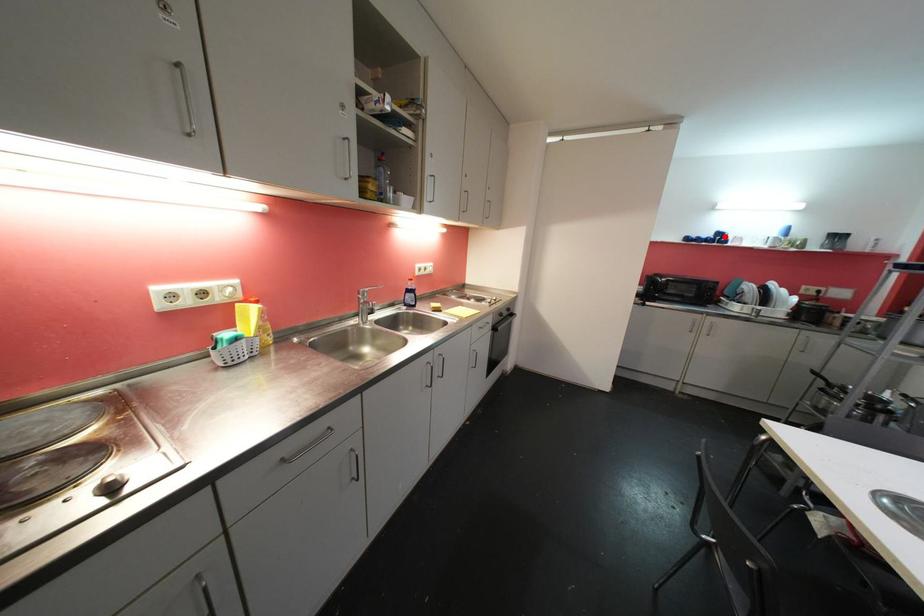
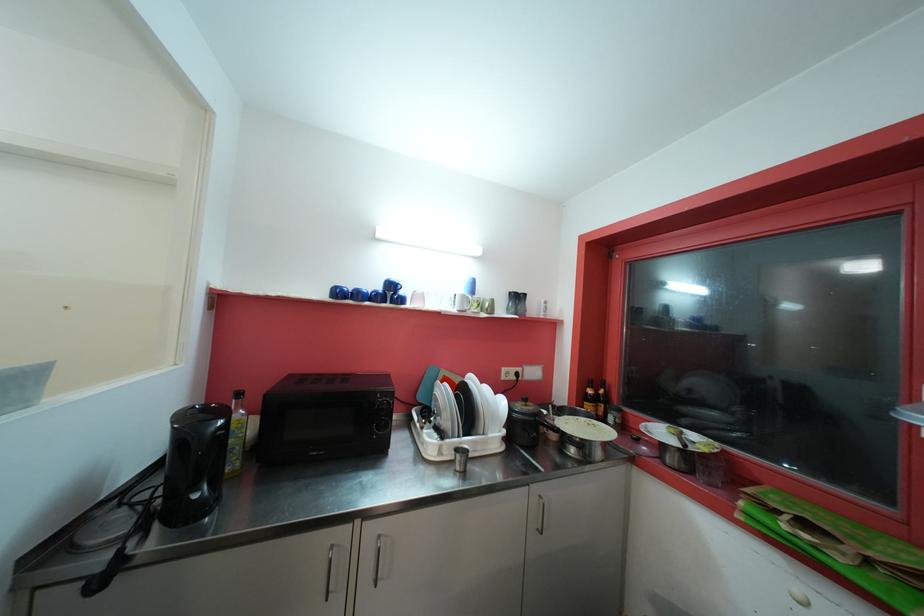
Locate, in the second image, the point that corresponds to the highlighted location in the first image.

(396, 288)